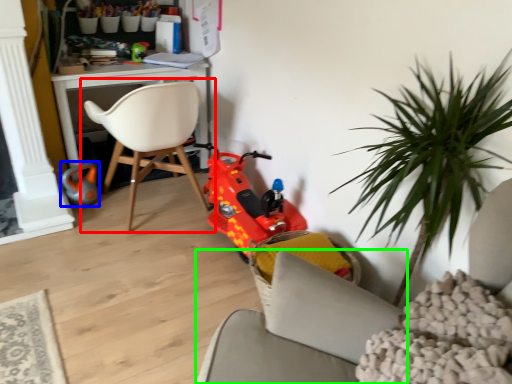
Question: Which object is positioned farthest from chair (highlighted by a red box)? Select from toy (highlighted by a blue box) and chair (highlighted by a green box).

Choices:
 (A) toy
 (B) chair

Answer: (B)